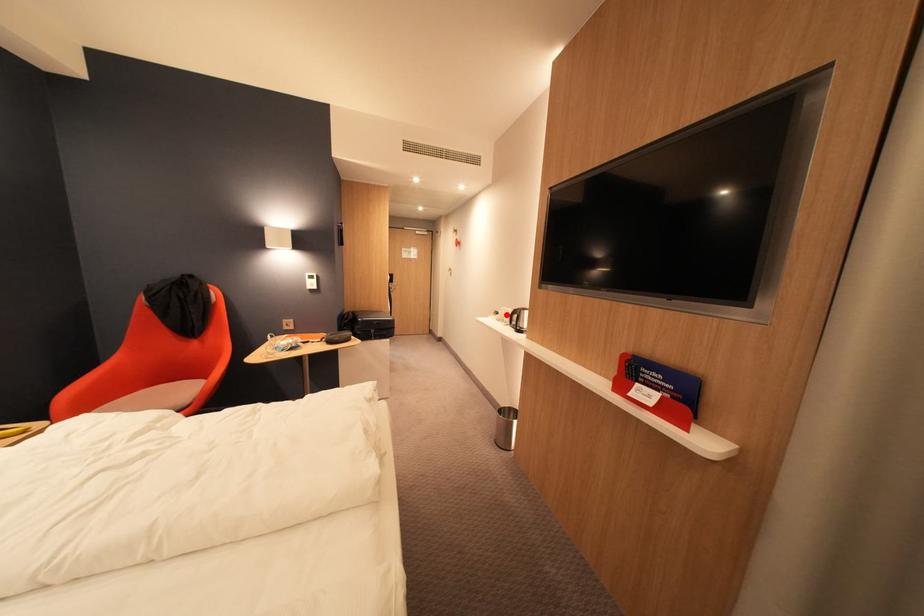
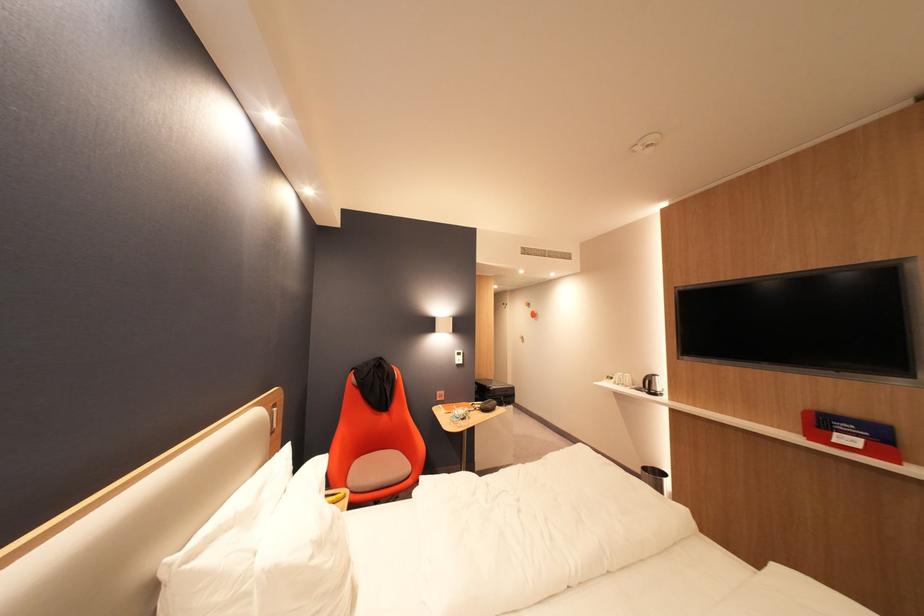
Locate, in the second image, the point that corresponds to the highlighted location in the first image.

(622, 379)